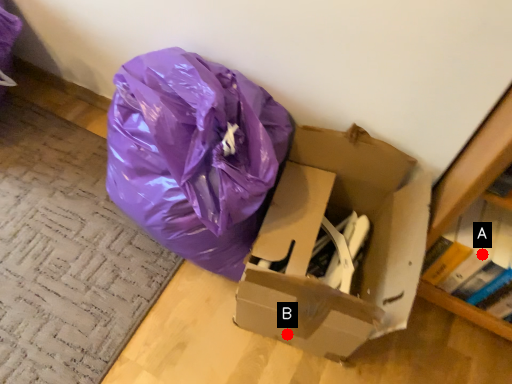
Question: Two points are circled on the image, labeled by A and B beside each circle. Which point appears farthest from the camera in this image?

Choices:
 (A) A is further
 (B) B is further

Answer: (B)